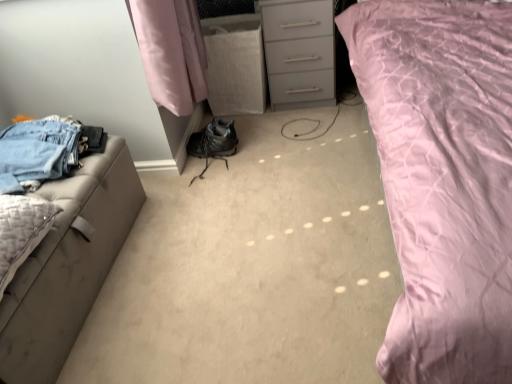
Where is `vacant region in front of matte gray chest of drawers at center`? vacant region in front of matte gray chest of drawers at center is located at coordinates (308, 126).